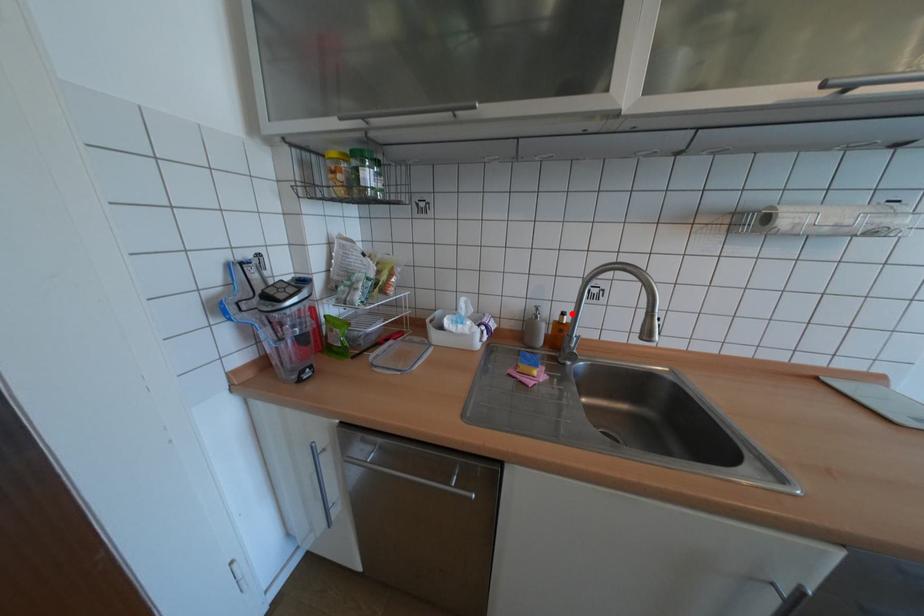
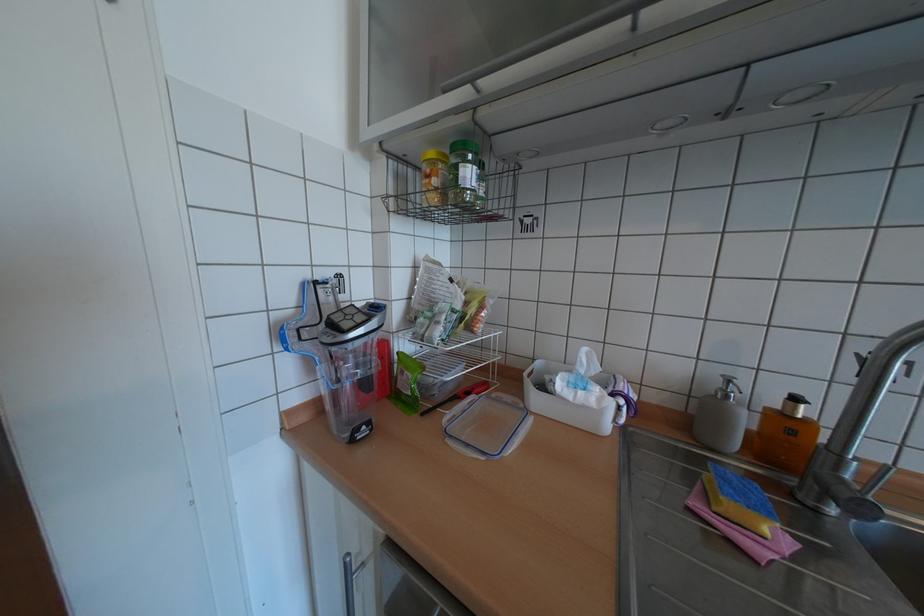
Question: I am providing you with two images of the same scene from different viewpoints. A red point is marked on the first image. Can you still see the location of the red point in image 2?

Choices:
 (A) Yes
 (B) No

Answer: (A)